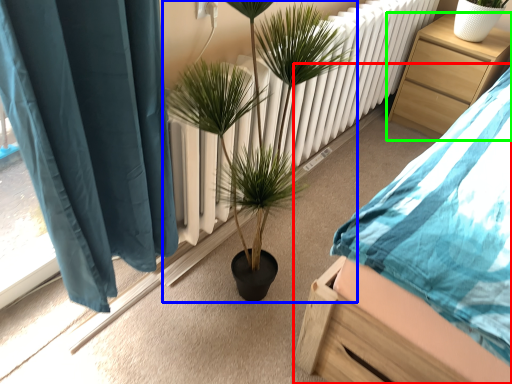
Question: Which object is positioned closest to bed (highlighted by a red box)? Select from houseplant (highlighted by a blue box) and nightstand (highlighted by a green box).

Choices:
 (A) houseplant
 (B) nightstand

Answer: (A)